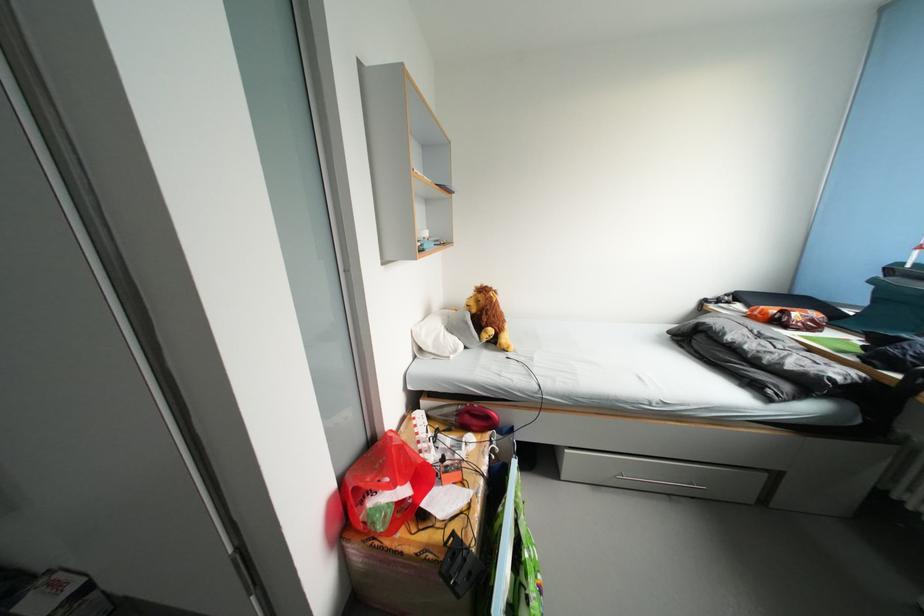
The width and height of the screenshot is (924, 616). In order to click on drawer handle in this screenshot , I will do `click(660, 483)`.